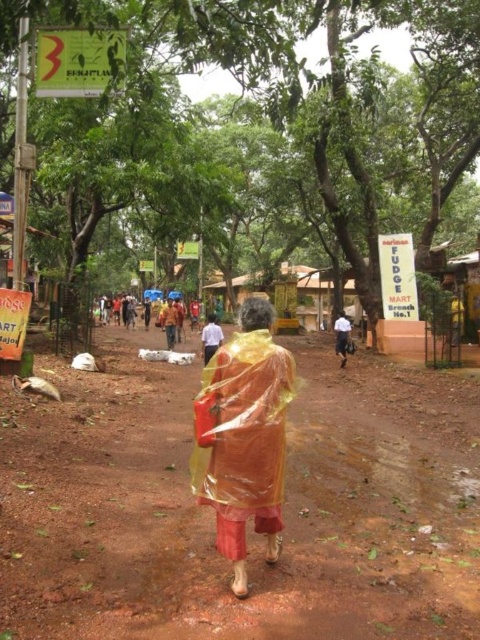
Looking at this image, you are standing in a rural area after a rain shower. You see a brown dirt field at center. Can you step onto it without getting your shoes muddy?

The brown dirt field at center is 2.95 meters away from you, so you can step onto it without getting your shoes muddy.

You are standing at the point with coordinates 0.7, 0.4 in the image. Which direction should you move to reach the brown dirt field at center?

The brown dirt field at center is located at point [213,515]. Since you are at [192,448], you should move northeast to reach it.